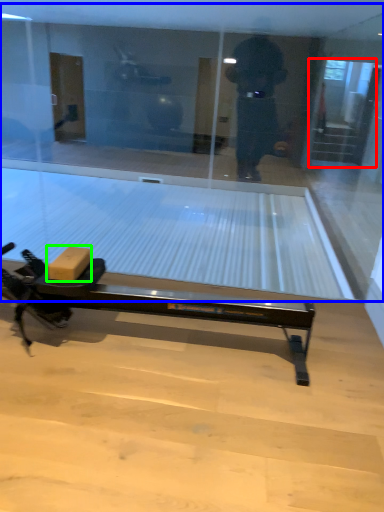
Question: Based on their relative distances, which object is nearer to screen door (highlighted by a red box)? Choose from shop window (highlighted by a blue box) and cardboard box (highlighted by a green box).

Choices:
 (A) shop window
 (B) cardboard box

Answer: (A)